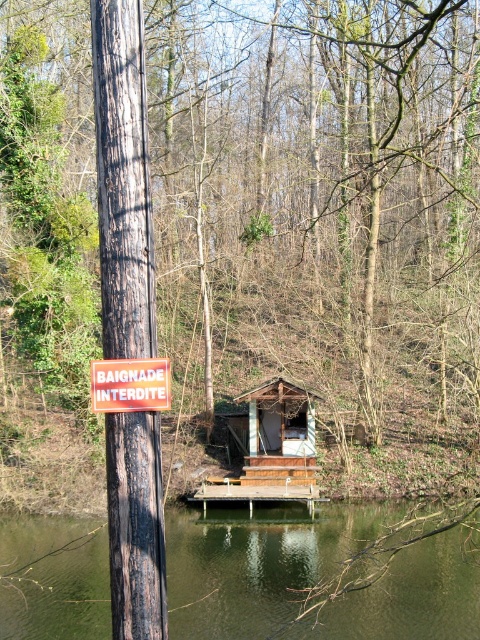
Question: Does greenish-brown water at lower center appear over dark brown wood telegraph pole at left?

Choices:
 (A) yes
 (B) no

Answer: (B)

Question: Which point is closer to the camera?

Choices:
 (A) greenish-brown water at lower center
 (B) orange plastic sign at upper center
 (C) dark brown wood telegraph pole at left

Answer: (B)

Question: Among these objects, which one is farthest from the camera?

Choices:
 (A) greenish-brown water at lower center
 (B) dark brown wood telegraph pole at left
 (C) orange plastic sign at upper center

Answer: (A)

Question: Does greenish-brown water at lower center have a smaller size compared to orange plastic sign at upper center?

Choices:
 (A) no
 (B) yes

Answer: (A)

Question: Which object appears farthest from the camera in this image?

Choices:
 (A) dark brown wood telegraph pole at left
 (B) orange plastic sign at upper center
 (C) greenish-brown water at lower center

Answer: (C)

Question: Does dark brown wood telegraph pole at left appear under orange plastic sign at upper center?

Choices:
 (A) no
 (B) yes

Answer: (A)